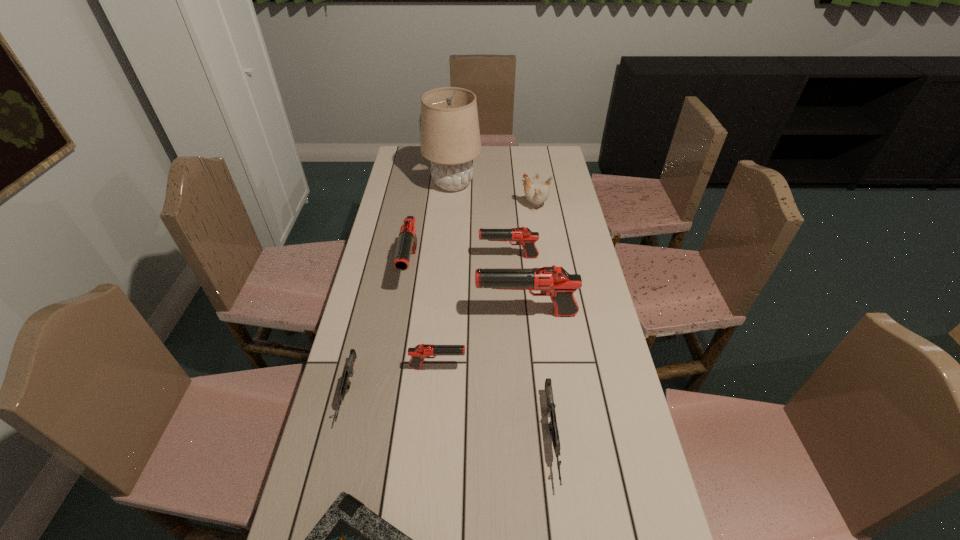
The image size is (960, 540). Identify the location of the bigger grey gun. (554, 433).

Identify the location of the left grey gun. Image resolution: width=960 pixels, height=540 pixels. (345, 384).

This screenshot has height=540, width=960. Find the location of `the smaller grey gun`. the smaller grey gun is located at coordinates (345, 384).

Identify the location of free space located on the front of the lampshade. (449, 225).

The width and height of the screenshot is (960, 540). Find the location of `free space located 0.380m at the aiming end of the eighth shortest object`. free space located 0.380m at the aiming end of the eighth shortest object is located at coordinates (356, 314).

Locate an element on the screen. The width and height of the screenshot is (960, 540). free space located at the aiming end of the eighth shortest object is located at coordinates (407, 314).

The height and width of the screenshot is (540, 960). Find the location of `free space located at the aiming end of the eighth shortest object`. free space located at the aiming end of the eighth shortest object is located at coordinates (460, 314).

At what (x,y) coordinates should I click in order to perform the action: click on vacant space situated at the aiming end of the third smallest black gun. Please return your answer as a coordinate pair (x, y). The height and width of the screenshot is (540, 960). Looking at the image, I should click on (404, 306).

The width and height of the screenshot is (960, 540). What are the coordinates of `vacant space located at the beak of the bird` in the screenshot? It's located at (483, 206).

Find the location of `vacant space situated 0.240m at the beak of the bird`. vacant space situated 0.240m at the beak of the bird is located at coordinates (462, 206).